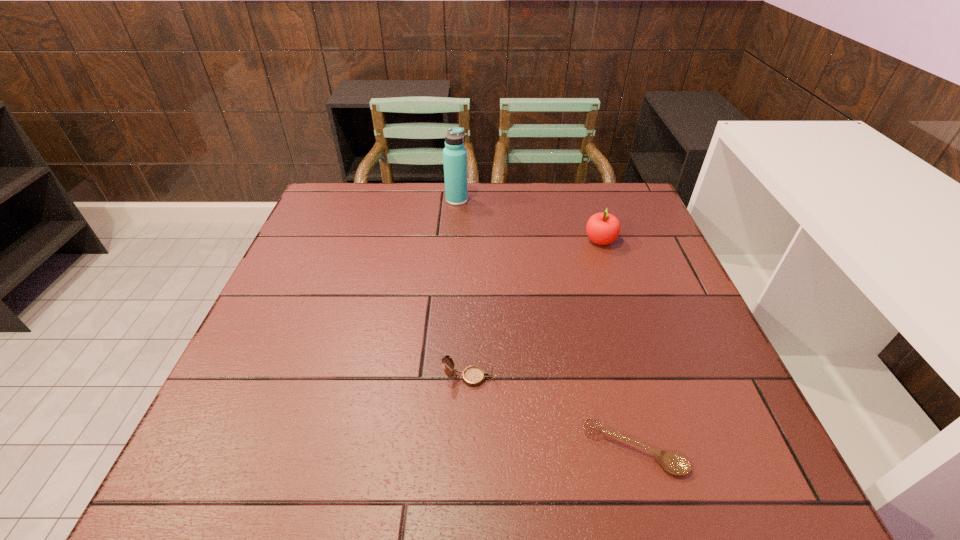
You are a GUI agent. You are given a task and a screenshot of the screen. Output one action in this format:
    pyautogui.click(x=<x>, y=<y>)
    Task: Click on the vacant space at the right edge of the desktop
    
    Given the screenshot: What is the action you would take?
    pyautogui.click(x=644, y=284)

The height and width of the screenshot is (540, 960). In the image, there is a desktop. In order to click on free region at the far left corner in this screenshot , I will do 351,194.

This screenshot has height=540, width=960. Identify the location of free space that is in between the apple and the tallest object. (528, 220).

Where is `free space between the third nearest object and the third tallest object`? Image resolution: width=960 pixels, height=540 pixels. free space between the third nearest object and the third tallest object is located at coordinates (535, 309).

Find the location of a particular element. free point between the farthest object and the third tallest object is located at coordinates (463, 289).

Find the location of a particular element. This screenshot has height=540, width=960. vacant space that is in between the thermos bottle and the nearest object is located at coordinates (545, 325).

Identify the location of free point between the thermos bottle and the third shortest object. The width and height of the screenshot is (960, 540). (528, 220).

Identify the location of unoccupied area between the third tallest object and the apple. (535, 309).

Find the location of a particular element. The height and width of the screenshot is (540, 960). vacant area that lies between the farthest object and the third tallest object is located at coordinates (463, 289).

The height and width of the screenshot is (540, 960). I want to click on vacant area between the nearest object and the second shortest object, so point(551,414).